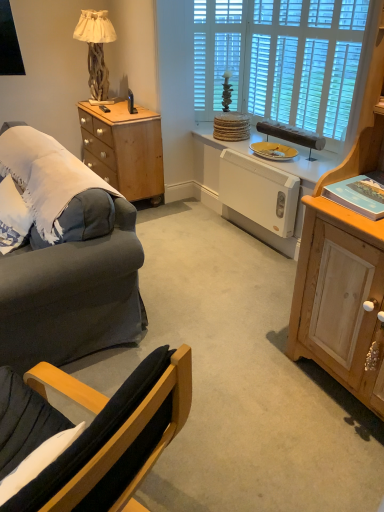
Identify the location of light wood cabinet at right. (343, 264).

This screenshot has height=512, width=384. Describe the element at coordinates (280, 60) in the screenshot. I see `white wooden blinds at upper center` at that location.

What is the approximate height of black plastic remote control at upper left?

1.42 inches.

Measure the distance between point (101, 106) and camera.

They are 3.51 meters apart.

What is the approximate height of natural wood lamp at upper left?

natural wood lamp at upper left is 72.62 centimeters tall.

What do you see at coordinates (125, 148) in the screenshot? Image resolution: width=384 pixels, height=512 pixels. I see `light wood/texture side table at left` at bounding box center [125, 148].

Identify the location of yellow matte plate at center. This screenshot has width=384, height=512. (273, 151).

Where is `light wood cabinet at right`? This screenshot has width=384, height=512. light wood cabinet at right is located at coordinates (343, 264).

Considering the positions of objects yellow matte plate at center and white plastic heater at center in the image provided, who is behind, yellow matte plate at center or white plastic heater at center?

yellow matte plate at center is more distant.

Considering the relative sizes of yellow matte plate at center and white plastic heater at center in the image provided, is yellow matte plate at center shorter than white plastic heater at center?

Yes.

From a real-world perspective, is yellow matte plate at center located higher than white plastic heater at center?

Yes.

Looking at this image, how many degrees apart are the facing directions of yellow matte plate at center and white plastic heater at center?

0.421 degrees separate the facing orientations of yellow matte plate at center and white plastic heater at center.

Would you consider natural wood lamp at upper left to be distant from dark blue fabric chair at lower left?

Yes, natural wood lamp at upper left and dark blue fabric chair at lower left are quite far apart.

From a real-world perspective, who is located higher, natural wood lamp at upper left or dark blue fabric chair at lower left?

natural wood lamp at upper left is physically above.

From the image's perspective, would you say natural wood lamp at upper left is positioned over dark blue fabric chair at lower left?

Correct, natural wood lamp at upper left appears higher than dark blue fabric chair at lower left in the image.

Does natural wood lamp at upper left contain dark blue fabric chair at lower left?

No, natural wood lamp at upper left does not contain dark blue fabric chair at lower left.

Is black plastic remote control at upper left touching yellow matte plate at center?

No, black plastic remote control at upper left is not in contact with yellow matte plate at center.

In the scene shown: Considering the sizes of objects black plastic remote control at upper left and yellow matte plate at center in the image provided, who is wider, black plastic remote control at upper left or yellow matte plate at center?

yellow matte plate at center.

Is yellow matte plate at center a part of black plastic remote control at upper left?

That's incorrect, yellow matte plate at center is not inside black plastic remote control at upper left.

Is dark blue fabric chair at lower left smaller than yellow matte plate at center?

No.

Would you consider dark blue fabric chair at lower left to be distant from yellow matte plate at center?

That's right, there is a large distance between dark blue fabric chair at lower left and yellow matte plate at center.

Is point (118, 438) positioned behind point (280, 156)?

That is False.

From the image's perspective, is dark blue fabric chair at lower left located beneath yellow matte plate at center?

Indeed, from the image's perspective, dark blue fabric chair at lower left is shown beneath yellow matte plate at center.

Considering the sizes of objects light wood/texture side table at left and dark blue fabric chair at lower left in the image provided, who is taller, light wood/texture side table at left or dark blue fabric chair at lower left?

Standing taller between the two is light wood/texture side table at left.

Can you confirm if light wood/texture side table at left is bigger than dark blue fabric chair at lower left?

Yes, light wood/texture side table at left is bigger than dark blue fabric chair at lower left.

Could you tell me if light wood/texture side table at left is turned towards dark blue fabric chair at lower left?

No, light wood/texture side table at left is not aimed at dark blue fabric chair at lower left.

Locate an element on the screen. This screenshot has width=384, height=512. table located behind the dark blue fabric chair at lower left is located at coordinates (125, 148).

The width and height of the screenshot is (384, 512). In order to click on window located on the right of dark blue fabric chair at lower left in this screenshot , I will do `click(280, 60)`.

Is white wooden blinds at upper center located within dark blue fabric chair at lower left?

Actually, white wooden blinds at upper center is outside dark blue fabric chair at lower left.

From the image's perspective, who appears lower, dark blue fabric chair at lower left or white wooden blinds at upper center?

From the image's view, dark blue fabric chair at lower left is below.

Does dark blue fabric chair at lower left come in front of white wooden blinds at upper center?

Yes, dark blue fabric chair at lower left is in front of white wooden blinds at upper center.

Considering the sizes of objects dark blue fabric chair at lower left and white plastic heater at center in the image provided, who is taller, dark blue fabric chair at lower left or white plastic heater at center?

white plastic heater at center.

Between dark blue fabric chair at lower left and white plastic heater at center, which one has smaller size?

white plastic heater at center.

From the picture: From a real-world perspective, is dark blue fabric chair at lower left below white plastic heater at center?

Incorrect, from a real-world perspective, dark blue fabric chair at lower left is higher than white plastic heater at center.

Between point (183, 409) and point (264, 200), which one is positioned in front?

The point (183, 409) is more forward.

What are the coordinates of `appliance located below the yellow matte plate at center (from the image's perspective)` in the screenshot? It's located at (259, 192).

Image resolution: width=384 pixels, height=512 pixels. I want to click on lamp above the dark blue fabric chair at lower left (from a real-world perspective), so click(96, 49).

Considering their positions, is black plastic remote control at upper left positioned further to light wood/texture side table at left than yellow matte plate at center?

Based on the image, yellow matte plate at center appears to be further to light wood/texture side table at left.

Estimate the real-world distances between objects in this image. Which object is further from light wood/texture side table at left, black plastic remote control at upper left or white plastic heater at center?

white plastic heater at center lies further to light wood/texture side table at left than the other object.

Consider the image. Which object lies nearer to the anchor point dark blue fabric chair at lower left, white textured glass door at upper center or light wood/texture side table at left?

The object closer to dark blue fabric chair at lower left is light wood/texture side table at left.

Based on their spatial positions, is dark blue fabric chair at lower left or natural wood lamp at upper left closer to white plastic heater at center?

Based on the image, natural wood lamp at upper left appears to be nearer to white plastic heater at center.

Estimate the real-world distances between objects in this image. Which object is further from white wooden blinds at upper center, white plastic heater at center or black plastic remote control at upper left?

black plastic remote control at upper left is further to white wooden blinds at upper center.

Which object lies further to the anchor point light wood cabinet at right, light wood/texture side table at left or white wooden blinds at upper center?

Based on the image, light wood/texture side table at left appears to be further to light wood cabinet at right.

Which object lies further to the anchor point yellow matte plate at center, natural wood lamp at upper left or black plastic remote control at upper left?

Among the two, natural wood lamp at upper left is located further to yellow matte plate at center.

Considering their positions, is yellow matte plate at center positioned further to black plastic remote control at upper left than natural wood lamp at upper left?

yellow matte plate at center lies further to black plastic remote control at upper left than the other object.

Locate an element on the screen. This screenshot has height=512, width=384. cabinetry between white wooden blinds at upper center and dark blue fabric chair at lower left vertically is located at coordinates (343, 264).

Identify the location of appliance positioned between light wood cabinet at right and yellow matte plate at center from near to far. (259, 192).

The height and width of the screenshot is (512, 384). I want to click on appliance situated between black plastic remote control at upper left and white wooden blinds at upper center from left to right, so click(x=259, y=192).

What are the coordinates of `remote control that lies between natural wood lamp at upper left and light wood/texture side table at left from top to bottom` in the screenshot? It's located at [104, 109].